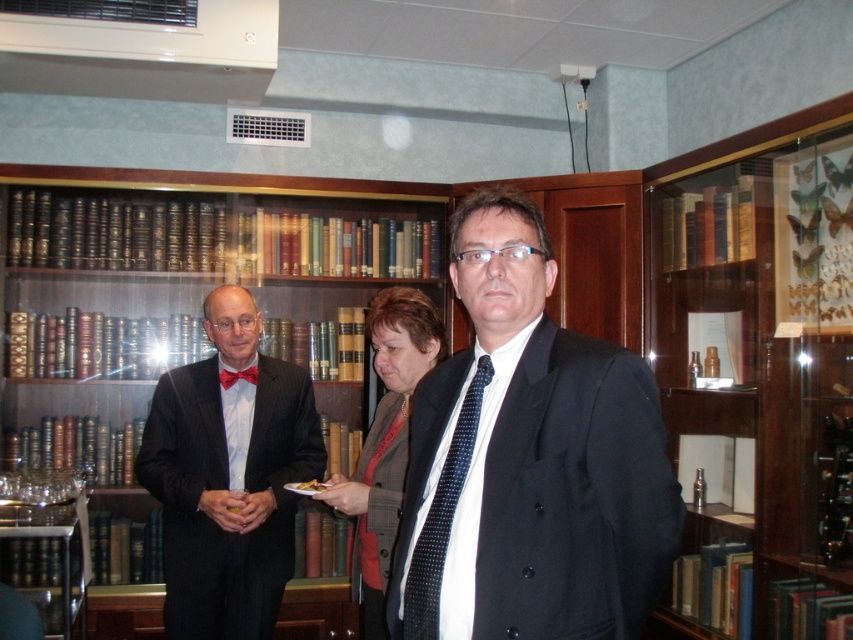
Question: Does dark wood bookcase at center appear under matte black suit at left?

Choices:
 (A) no
 (B) yes

Answer: (A)

Question: Does matte black suit at center appear over matte black suit at left?

Choices:
 (A) no
 (B) yes

Answer: (B)

Question: Which point appears farthest from the camera in this image?

Choices:
 (A) (254, 365)
 (B) (247, 356)
 (C) (267, 481)
 (D) (428, 557)

Answer: (A)

Question: Which point is closer to the camera?

Choices:
 (A) matte black suit at center
 (B) matte black suit at left
 (C) matte red bow tie at center
 (D) dark wood bookcase at center

Answer: (A)

Question: In this image, where is wooden bookshelf at upper right located relative to matte black suit at left?

Choices:
 (A) left
 (B) right

Answer: (B)

Question: Which object appears farthest from the camera in this image?

Choices:
 (A) wooden bookshelf at upper right
 (B) black dotted tie at center

Answer: (A)